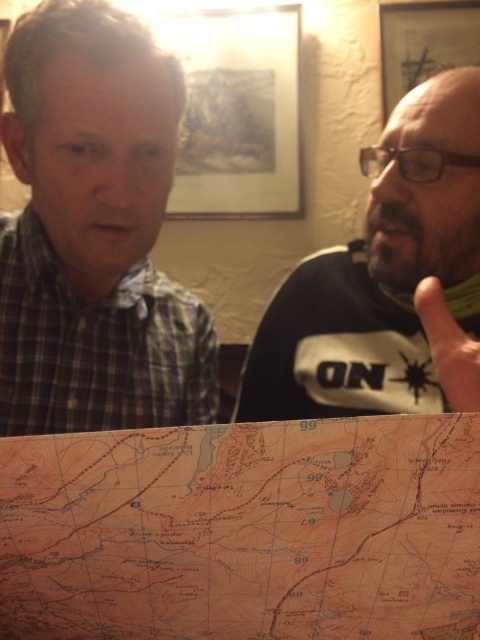
Question: Which point is farther to the camera?

Choices:
 (A) bearded man at right
 (B) orange paper map at lower center

Answer: (A)

Question: Can you confirm if orange paper map at lower center is smaller than green plaid shirt at upper left?

Choices:
 (A) yes
 (B) no

Answer: (A)

Question: Which object appears farthest from the camera in this image?

Choices:
 (A) green plaid shirt at upper left
 (B) bearded man at right

Answer: (A)

Question: Which point is closer to the camera taking this photo?

Choices:
 (A) (147, 321)
 (B) (472, 164)

Answer: (B)

Question: Does orange paper map at lower center lie behind green plaid shirt at upper left?

Choices:
 (A) no
 (B) yes

Answer: (A)

Question: Can you confirm if orange paper map at lower center is thinner than bearded man at right?

Choices:
 (A) yes
 (B) no

Answer: (B)